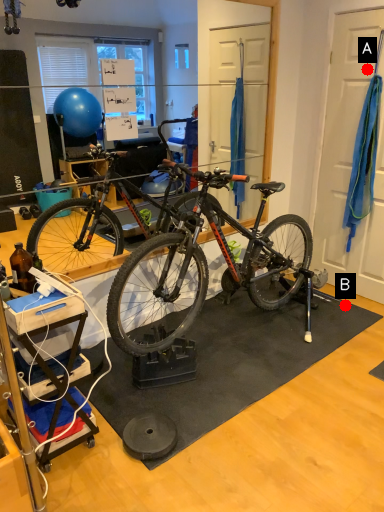
Question: Two points are circled on the image, labeled by A and B beside each circle. Which point appears closest to the camera in this image?

Choices:
 (A) A is closer
 (B) B is closer

Answer: (A)